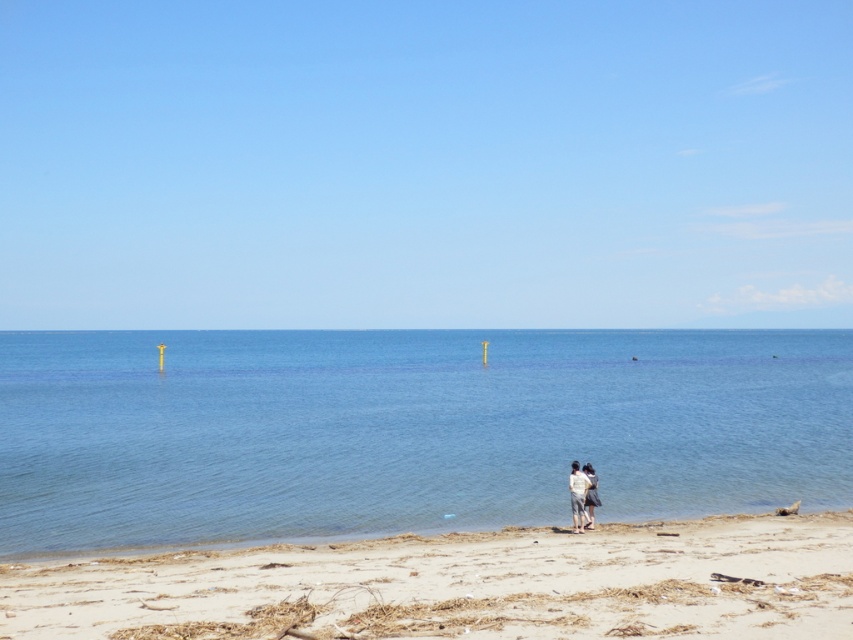
You are a photographer trying to capture the white cotton shirt at center and the light beige sand at lower center in the same frame. Based on their positions, which object appears closer to the camera?

The white cotton shirt at center appears closer to the camera because it has a greater height than the light beige sand at lower center.

You are standing on the beach and want to walk towards the water. There is light beige sand at lower center and a white cotton shirt at center in your view. Which object will you encounter first as you move forward?

The light beige sand at lower center is in front of the white cotton shirt at center, so you will encounter the light beige sand at lower center first as you move forward.

You are standing on the beach and see the light beige sand at lower center and the light gray cotton shirt at lower center. Which object is positioned to the left of the other?

The light beige sand at lower center is to the left of the light gray cotton shirt at lower center.